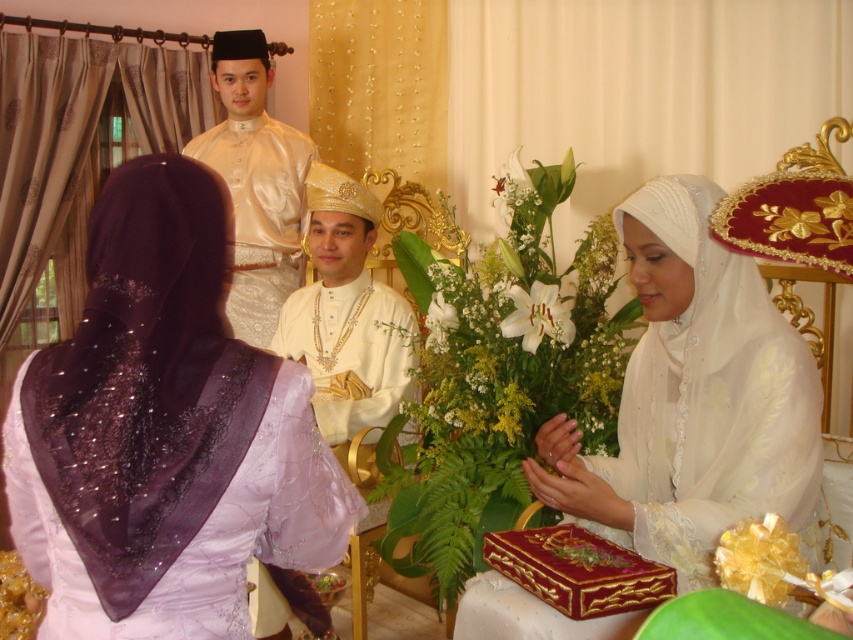
You are a photographer at the wedding ceremony. You want to take a photo that includes both the point at position (27, 504) and the point at position (769, 442). Based on their positions, which point should you focus on first to ensure both are in the frame?

Since point (27, 504) is in front of point (769, 442), you should focus on point (27, 504) first to ensure both are in the frame.

You are a photographer at the wedding ceremony. You need to capture a closeup shot of the purple satin hijab at left and white sheer veil at center. Which object should you zoom in on first to ensure both are in frame?

The purple satin hijab at left occupies less space than the white sheer veil at center, so you should zoom in on the purple satin hijab at left first to ensure both are in frame.